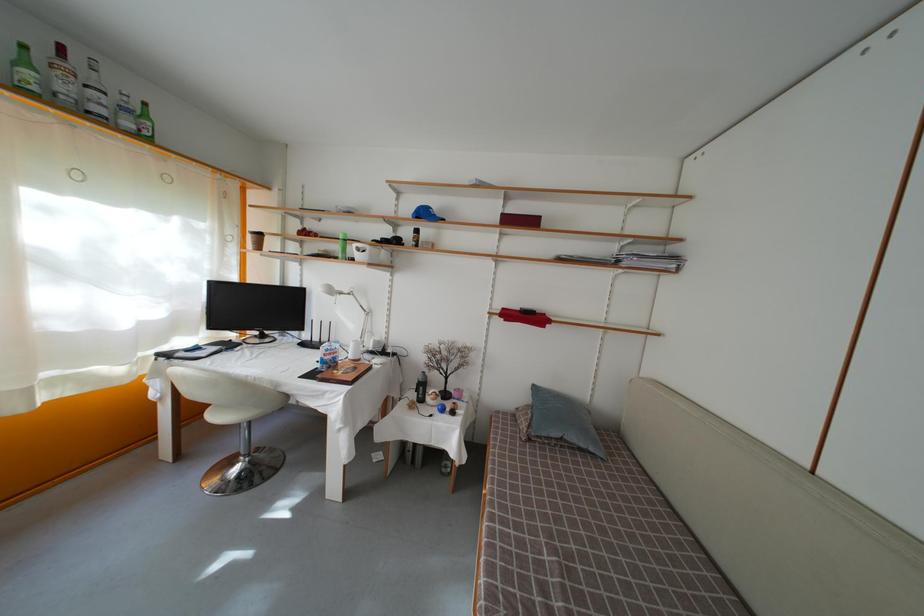
I want to click on sofa sitting surface, so click(x=589, y=540).